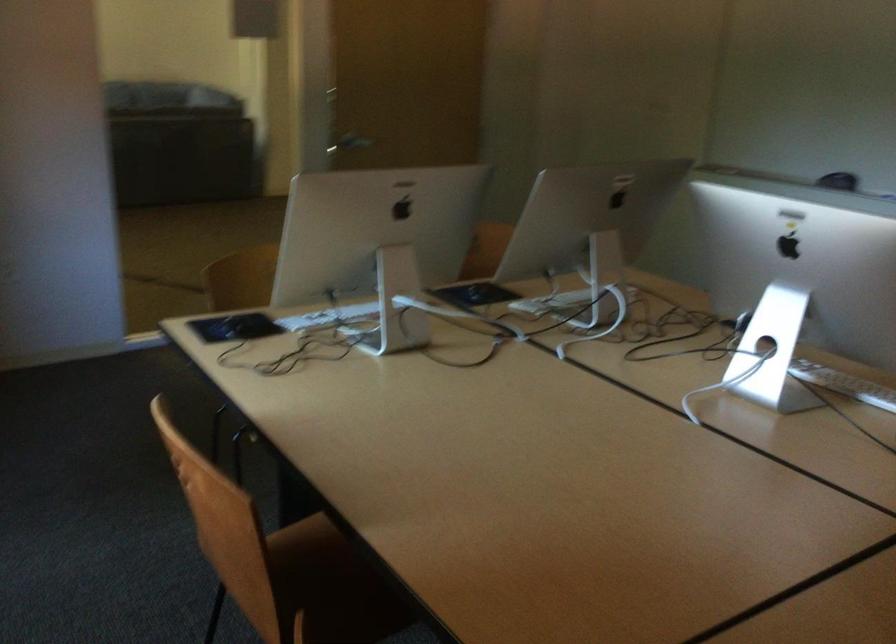
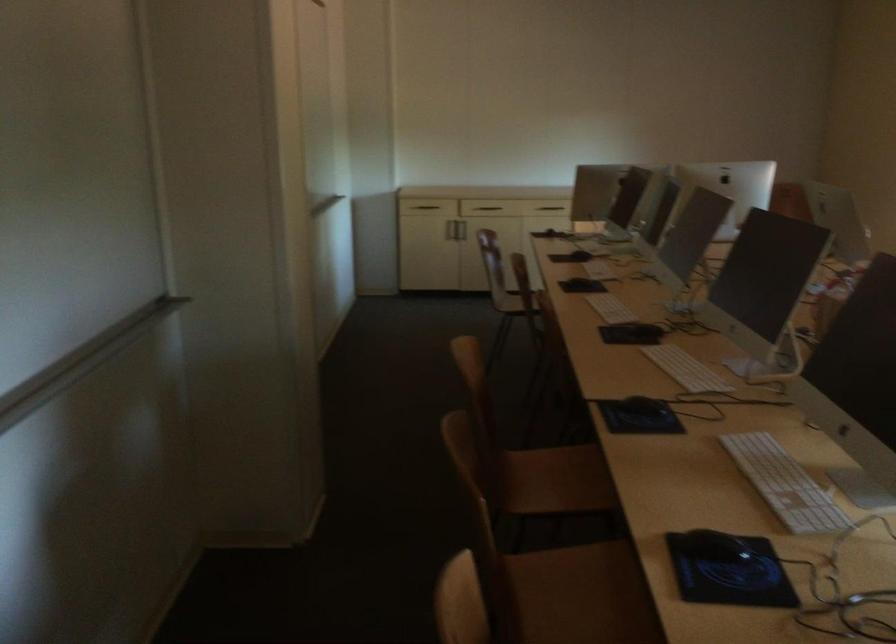
Locate, in the second image, the point that corresponds to pixel 819 377 in the first image.

(784, 484)